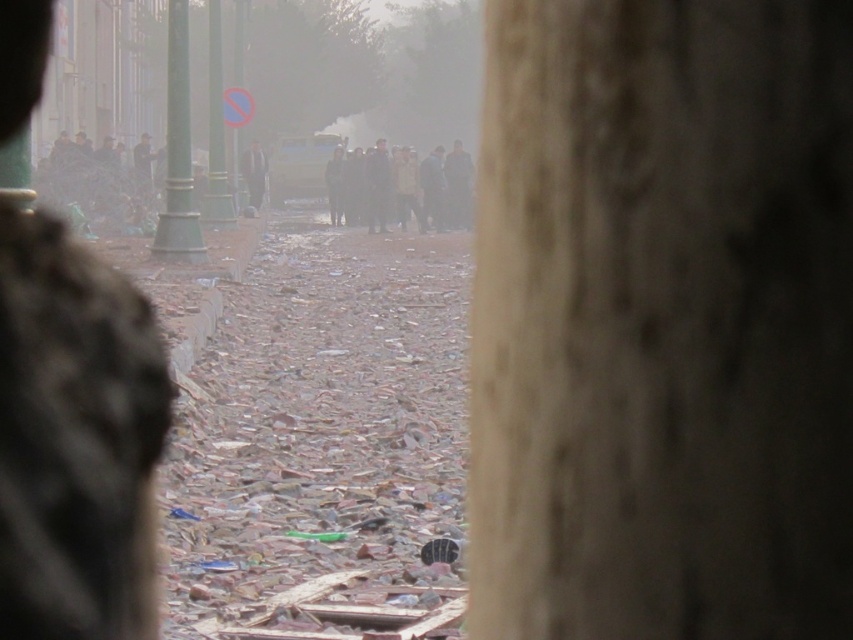
Question: Can you confirm if dark gray clothing at center is wider than dark gray jacket at center?

Choices:
 (A) no
 (B) yes

Answer: (B)

Question: Among these points, which one is nearest to the camera?

Choices:
 (A) (468, 163)
 (B) (260, 150)
 (C) (770, 83)

Answer: (C)

Question: Does smooth concrete pillar at center lie behind dark gray jacket at center?

Choices:
 (A) no
 (B) yes

Answer: (A)

Question: Which point is closer to the camera?

Choices:
 (A) dark gray jacket at center
 (B) dark gray clothing at center
 (C) green metallic pole at upper center
 (D) broken glass shards at center

Answer: (D)

Question: Can you confirm if green polished metal pole at left is positioned above dark gray jacket at center?

Choices:
 (A) no
 (B) yes

Answer: (A)

Question: Which object appears closest to the camera in this image?

Choices:
 (A) green metallic pole at upper center
 (B) broken glass shards at center
 (C) dark gray clothing at center
 (D) green polished metal pole at left

Answer: (B)